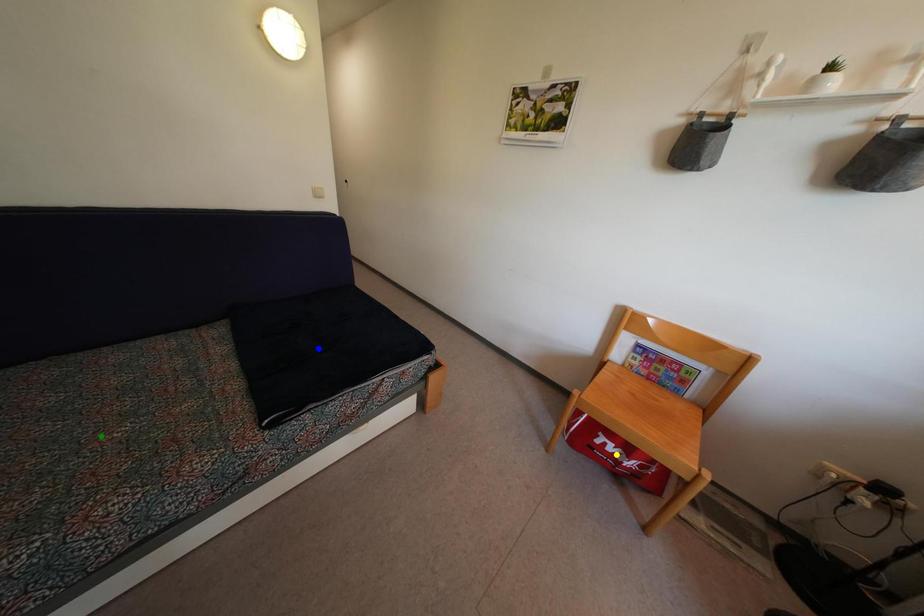
Order these from nearest to farthest:
1. blue point
2. yellow point
3. green point

1. green point
2. yellow point
3. blue point